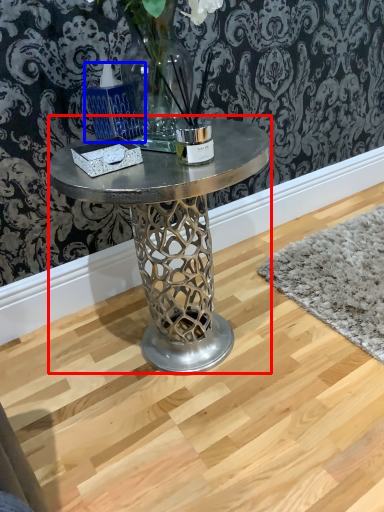
Question: Which point is closer to the camera, coffee table (highlighted by a red box) or candle holder (highlighted by a blue box)?

Choices:
 (A) coffee table
 (B) candle holder

Answer: (B)